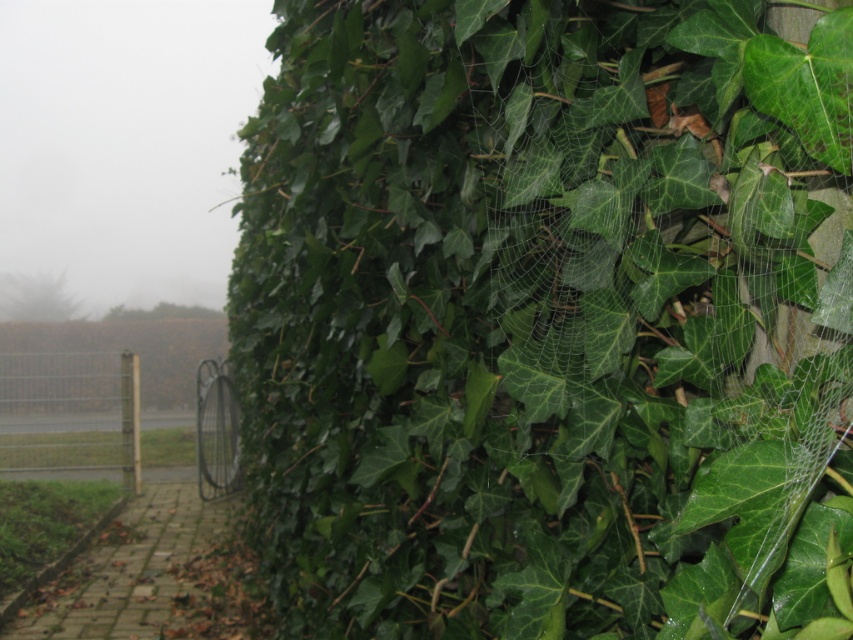
In the scene shown: You are standing in front of the ivy wall and want to touch the green leafy spider web at upper right. If your hand can reach up to 30 inches, will you be able to reach it?

The green leafy spider web at upper right is 31.24 inches away from the viewer, so your hand can only reach up to 30 inches, meaning you cannot reach it.

You are a gardener trying to remove the green leafy spider web at upper right and the metallic wire fence at left. Which object requires a wider tool for removal?

The metallic wire fence at left requires a wider tool because the green leafy spider web at upper right is narrower than the metallic wire fence at left.

You are standing in front of the ivy wall and want to walk towards the metal gate. There are two points marked on the image. Which point, point (776,401) or point (97,365), is closer to your current position?

Point (776,401) is closer to your current position because it is in front of point (97,365).